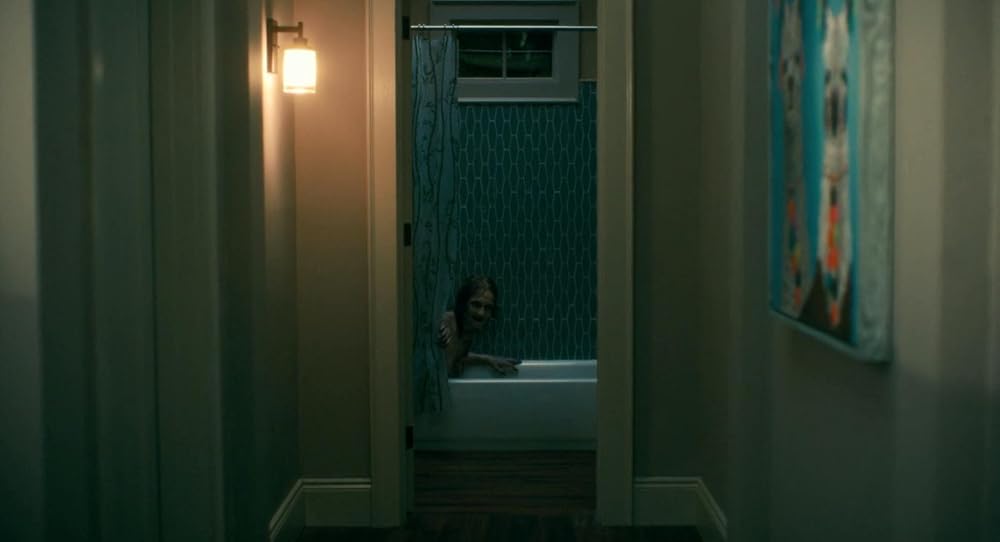
Find the location of a particular element. The width and height of the screenshot is (1000, 542). floor moulding is located at coordinates (341, 496).